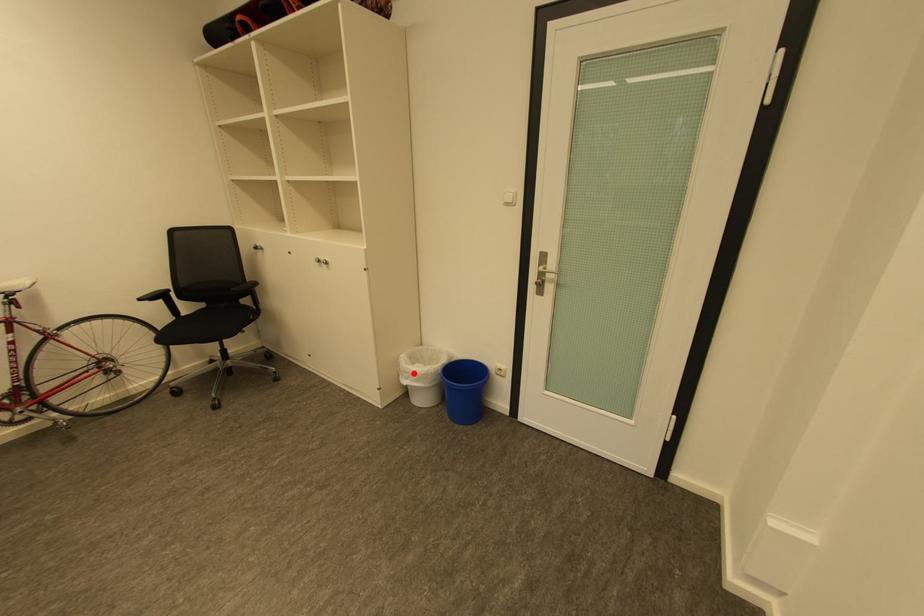
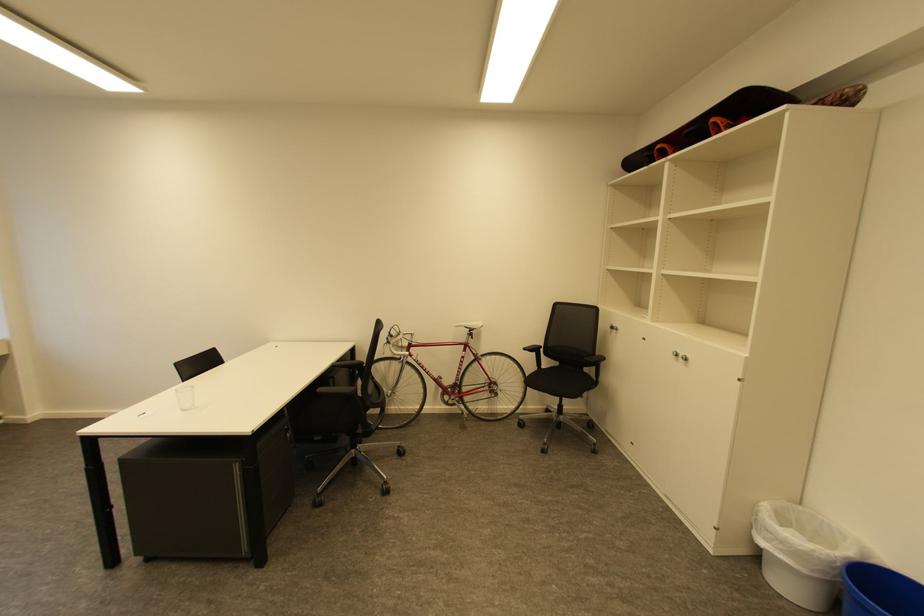
The point at the highlighted location is marked in the first image. Where is the corresponding point in the second image?

(775, 533)